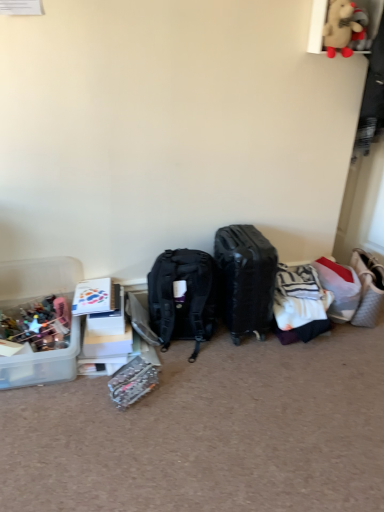
Question: From the image's perspective, is translucent plastic container at lower left above or below white quilted fabric handbag at right?

Choices:
 (A) below
 (B) above

Answer: (A)

Question: Considering the positions of translucent plastic container at lower left and white quilted fabric handbag at right in the image, is translucent plastic container at lower left wider or thinner than white quilted fabric handbag at right?

Choices:
 (A) thin
 (B) wide

Answer: (B)

Question: Estimate the real-world distances between objects in this image. Which object is closer to the white quilted fabric handbag at right?

Choices:
 (A) black matte suitcase at center
 (B) white plastic storage box at left
 (C) translucent plastic container at lower left
 (D) fluffy beige teddy bear at upper right
 (E) black matte backpack at center

Answer: (A)

Question: Which object is positioned closest to the white striped fabric at center-right?

Choices:
 (A) white plastic storage box at left
 (B) black matte suitcase at center
 (C) translucent plastic container at lower left
 (D) white quilted fabric handbag at right
 (E) clear plastic kit at lower center

Answer: (B)